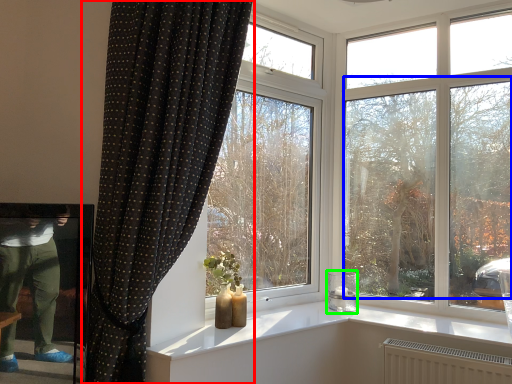
Question: Which object is the farthest from curtain (highlighted by a red box)? Choose among these: tree (highlighted by a blue box) or candle holder (highlighted by a green box).

Choices:
 (A) tree
 (B) candle holder

Answer: (B)